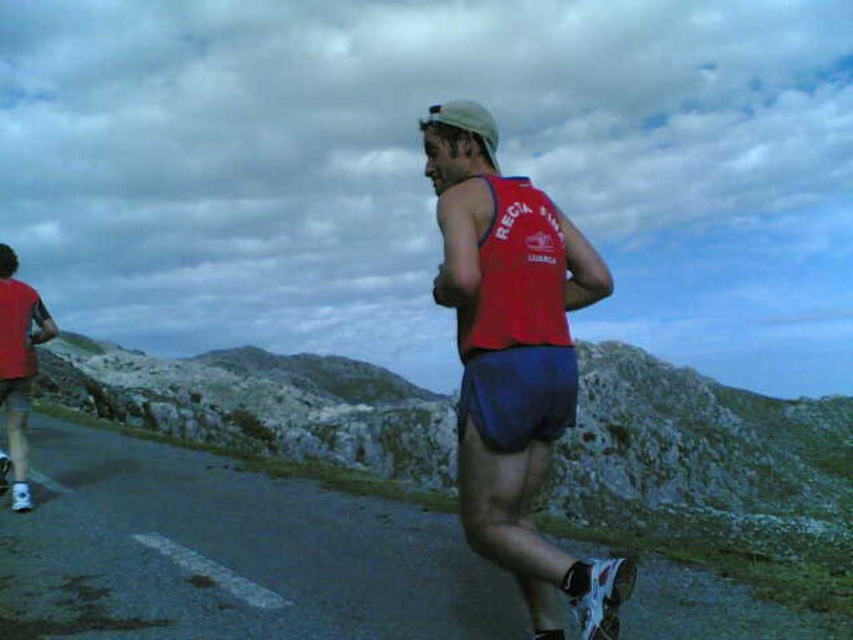
Question: Among these points, which one is nearest to the camera?

Choices:
 (A) (482, 161)
 (B) (115, 436)

Answer: (A)

Question: Does dark asphalt road at center have a greater width compared to matte red tank top at center?

Choices:
 (A) yes
 (B) no

Answer: (B)

Question: Which of the following is the farthest from the observer?

Choices:
 (A) (556, 307)
 (B) (300, 595)

Answer: (B)

Question: Does dark asphalt road at center have a smaller size compared to matte red tank top at center?

Choices:
 (A) yes
 (B) no

Answer: (A)

Question: Can you confirm if dark asphalt road at center is thinner than matte red tank top at center?

Choices:
 (A) no
 (B) yes

Answer: (B)